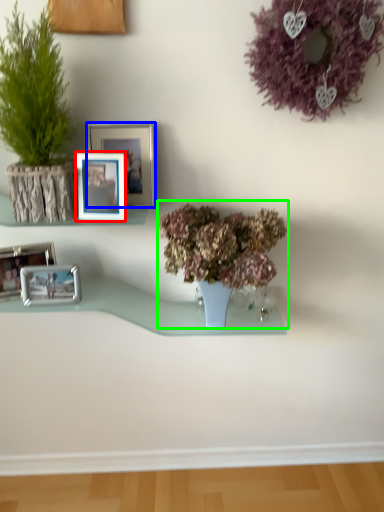
Question: Considering the real-world distances, which object is closest to picture frame (highlighted by a red box)? picture frame (highlighted by a blue box) or houseplant (highlighted by a green box).

Choices:
 (A) picture frame
 (B) houseplant

Answer: (A)